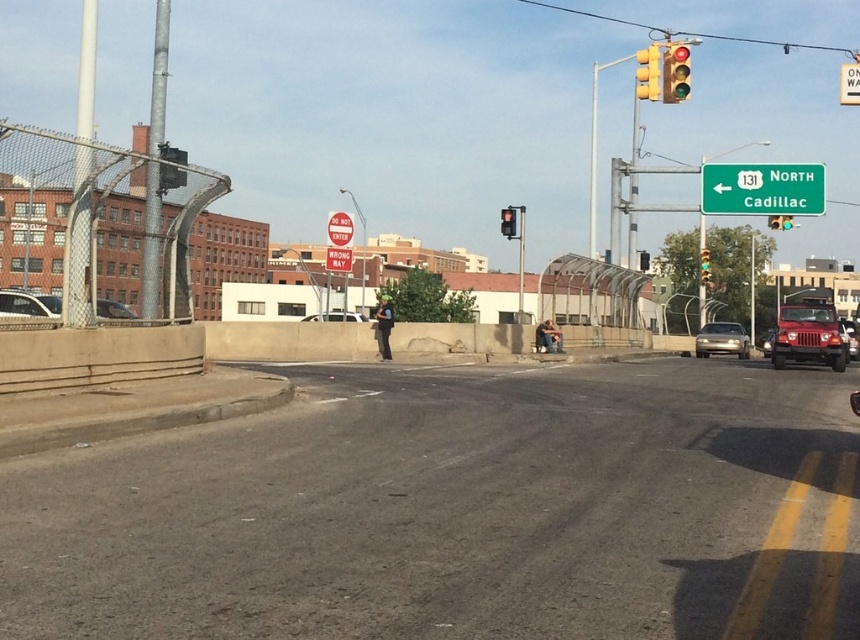
Question: Can you confirm if green metallic sign at upper right is positioned above red glass traffic light at center?

Choices:
 (A) no
 (B) yes

Answer: (A)

Question: Which object appears farthest from the camera in this image?

Choices:
 (A) wrong way sign at center
 (B) brushed metal sign at center
 (C) metallic silver sedan at left

Answer: (A)

Question: Which of these objects is positioned farthest from the matte black suv at right?

Choices:
 (A) satin silver sedan at center
 (B) metallic yellow traffic light at upper right
 (C) green glass traffic light at upper center

Answer: (C)

Question: Among these points, which one is nearest to the camera?

Choices:
 (A) (677, 83)
 (B) (344, 257)
 (C) (164, 150)
 (D) (314, 316)

Answer: (C)

Question: Is metallic traffic light at upper left to the right of matte black suv at right from the viewer's perspective?

Choices:
 (A) yes
 (B) no

Answer: (B)

Question: Is shiny silver sedan at center above matte black suv at right?

Choices:
 (A) yes
 (B) no

Answer: (A)